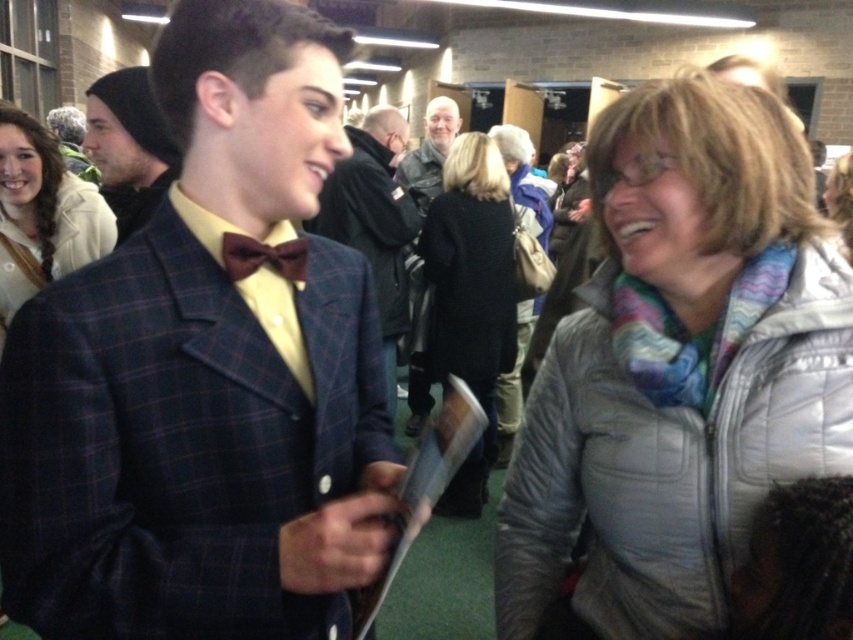
Question: Is gray quilted jacket at right to the right of plaid wool jacket at center from the viewer's perspective?

Choices:
 (A) yes
 (B) no

Answer: (B)

Question: Is plaid wool blazer at center smaller than light brown leather jacket at upper left?

Choices:
 (A) no
 (B) yes

Answer: (A)

Question: Does dark blue plaid suit at center have a smaller size compared to matte brown bow tie at center?

Choices:
 (A) no
 (B) yes

Answer: (A)

Question: Which of the following is the closest to the observer?

Choices:
 (A) (96, 220)
 (B) (605, 595)

Answer: (B)

Question: Which object appears farthest from the camera in this image?

Choices:
 (A) dark gray leather jacket at center
 (B) black wool coat at center

Answer: (A)

Question: Which object appears farthest from the camera in this image?

Choices:
 (A) dark gray leather jacket at center
 (B) plaid fabric suit at center
 (C) dark blue plaid suit at center

Answer: (A)